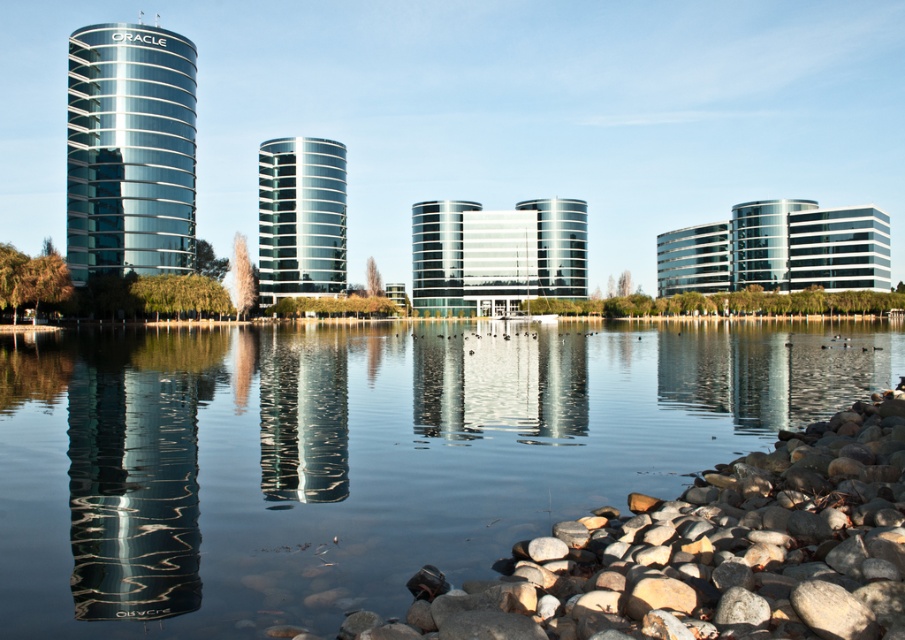
From the picture: Between glossy glass building at left and glossy glass tower at center, which one has less height?

Standing shorter between the two is glossy glass building at left.

Is point (170, 490) more distant than point (272, 301)?

No, (170, 490) is closer to viewer.

The height and width of the screenshot is (640, 905). What are the coordinates of `glossy glass building at left` in the screenshot? It's located at (134, 484).

What do you see at coordinates (134, 484) in the screenshot? This screenshot has width=905, height=640. I see `glossy glass building at left` at bounding box center [134, 484].

Is point (197, 566) positioned in front of point (106, 38)?

Yes, it is in front of point (106, 38).

Between point (199, 378) and point (148, 211), which one is positioned in front?

Point (199, 378)

The width and height of the screenshot is (905, 640). Find the location of `glossy glass building at left`. glossy glass building at left is located at coordinates (134, 484).

Looking at this image, between smooth gray rock at lower right and glossy glass tower at left, which one is positioned lower?

smooth gray rock at lower right is below.

This screenshot has height=640, width=905. Describe the element at coordinates (710, 552) in the screenshot. I see `smooth gray rock at lower right` at that location.

This screenshot has height=640, width=905. What are the coordinates of `smooth gray rock at lower right` in the screenshot? It's located at (710, 552).